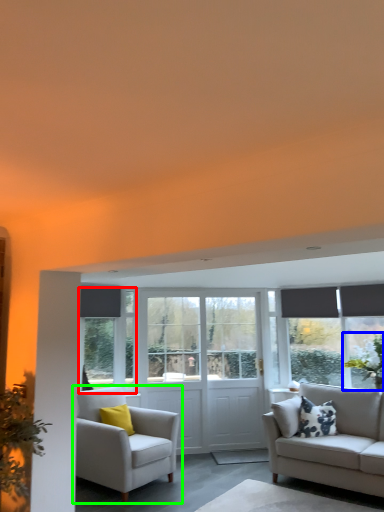
Question: Considering the real-world distances, which object is closest to window (highlighted by a red box)? plant (highlighted by a blue box) or chair (highlighted by a green box).

Choices:
 (A) plant
 (B) chair

Answer: (B)